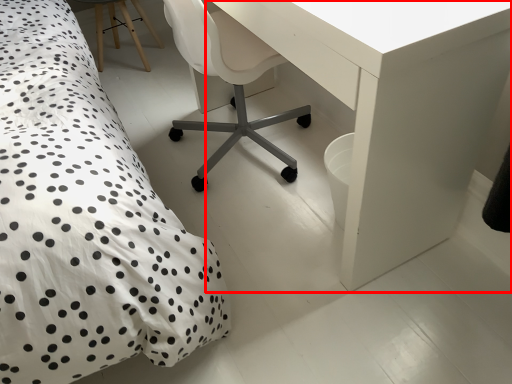
Question: From the image's perspective, considering the relative positions of table (annotated by the red box) and chair in the image provided, where is table (annotated by the red box) located with respect to the staircase?

Choices:
 (A) below
 (B) above

Answer: (A)